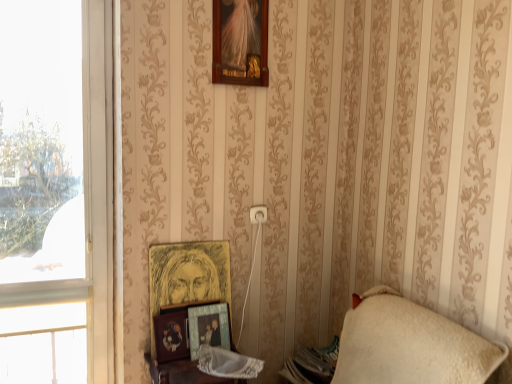
What is the approximate height of white fabric window at left, the 1th window from the bottom?

white fabric window at left, the 1th window from the bottom, is 8.51 inches tall.

In order to click on metallic silver frame at lower center, positioned as the 1th picture frame in bottom-to-top order in this screenshot , I will do `click(208, 327)`.

What do you see at coordinates (189, 273) in the screenshot? I see `gold textured frame at center, arranged as the 2th picture frame when viewed from the top` at bounding box center [189, 273].

This screenshot has width=512, height=384. What do you see at coordinates (170, 336) in the screenshot?
I see `wooden photo frame at lower center, which is the 2th picture frame from bottom to top` at bounding box center [170, 336].

The image size is (512, 384). What do you see at coordinates (183, 373) in the screenshot?
I see `wooden table at lower center` at bounding box center [183, 373].

The width and height of the screenshot is (512, 384). I want to click on white fabric window at left, which is the second window from top to bottom, so click(42, 344).

Is wooden photo frame at lower center, marked as the third picture frame in a top-to-bottom arrangement, not within transparent glass window at left, the first window from the top?

Yes.

From the image's perspective, who appears lower, wooden photo frame at lower center, which is the 2th picture frame from bottom to top, or transparent glass window at left, the first window from the top?

wooden photo frame at lower center, which is the 2th picture frame from bottom to top, is shown below in the image.

From a real-world perspective, which is physically above, wooden photo frame at lower center, which is the 2th picture frame from bottom to top, or transparent glass window at left, the first window from the top?

transparent glass window at left, the first window from the top.

Is the surface of wooden photo frame at lower center, marked as the third picture frame in a top-to-bottom arrangement, in direct contact with transparent glass window at left, the first window from the top?

wooden photo frame at lower center, marked as the third picture frame in a top-to-bottom arrangement, and transparent glass window at left, the first window from the top, are clearly separated.

Who is shorter, wooden photo frame at lower center, which is the 2th picture frame from bottom to top, or wooden table at lower center?

wooden photo frame at lower center, which is the 2th picture frame from bottom to top, is shorter.

Is wooden photo frame at lower center, which is the 2th picture frame from bottom to top, bigger or smaller than wooden table at lower center?

In the image, wooden photo frame at lower center, which is the 2th picture frame from bottom to top, appears to be smaller than wooden table at lower center.

Can we say wooden photo frame at lower center, which is the 2th picture frame from bottom to top, lies outside wooden table at lower center?

That's correct, wooden photo frame at lower center, which is the 2th picture frame from bottom to top, is outside of wooden table at lower center.

From a real-world perspective, who is located higher, wooden photo frame at lower center, marked as the third picture frame in a top-to-bottom arrangement, or wooden table at lower center?

From a 3D spatial view, wooden photo frame at lower center, marked as the third picture frame in a top-to-bottom arrangement, is above.

From a real-world perspective, who is located higher, metallic silver frame at lower center, the 4th picture frame positioned from the top, or wooden frame at upper center, the 4th picture frame when ordered from bottom to top?

wooden frame at upper center, the 4th picture frame when ordered from bottom to top.

Is metallic silver frame at lower center, the 4th picture frame positioned from the top, in front of or behind wooden frame at upper center, the 4th picture frame when ordered from bottom to top, in the image?

In the image, metallic silver frame at lower center, the 4th picture frame positioned from the top, appears behind wooden frame at upper center, the 4th picture frame when ordered from bottom to top.

Which object is thinner, metallic silver frame at lower center, the 4th picture frame positioned from the top, or wooden frame at upper center, the 1th picture frame from the top?

wooden frame at upper center, the 1th picture frame from the top.

Identify the location of the 2nd picture frame in front when counting from the metallic silver frame at lower center, the 4th picture frame positioned from the top. Image resolution: width=512 pixels, height=384 pixels. (240, 42).

Is white fabric window at left, which is the second window from top to bottom, shorter than wooden table at lower center?

Yes.

Identify the location of the 2nd window behind the wooden table at lower center. The height and width of the screenshot is (384, 512). (42, 344).

From a real-world perspective, which object stands above the other?

white fabric window at left, which is the second window from top to bottom, from a real-world perspective.

Does white fabric window at left, the 1th window from the bottom, have a smaller size compared to wooden table at lower center?

Correct, white fabric window at left, the 1th window from the bottom, occupies less space than wooden table at lower center.

Is point (215, 322) less distant than point (173, 312)?

That is False.

Based on their positions, is metallic silver frame at lower center, the 4th picture frame positioned from the top, located to the left or right of wooden photo frame at lower center, which is the 2th picture frame from bottom to top?

Clearly, metallic silver frame at lower center, the 4th picture frame positioned from the top, is on the right of wooden photo frame at lower center, which is the 2th picture frame from bottom to top, in the image.

Which object is thinner, metallic silver frame at lower center, the 4th picture frame positioned from the top, or wooden photo frame at lower center, marked as the third picture frame in a top-to-bottom arrangement?

metallic silver frame at lower center, the 4th picture frame positioned from the top.

Does metallic silver frame at lower center, the 4th picture frame positioned from the top, turn towards wooden photo frame at lower center, which is the 2th picture frame from bottom to top?

No, metallic silver frame at lower center, the 4th picture frame positioned from the top, is not facing towards wooden photo frame at lower center, which is the 2th picture frame from bottom to top.

Is transparent glass window at left, the 2th window in the bottom-to-top sequence, inside or outside of wooden photo frame at lower center, which is the 2th picture frame from bottom to top?

The correct answer is: outside.

Consider the image. From the image's perspective, does transparent glass window at left, the first window from the top, appear higher than wooden photo frame at lower center, which is the 2th picture frame from bottom to top?

Yes, from the image's perspective, transparent glass window at left, the first window from the top, is on top of wooden photo frame at lower center, which is the 2th picture frame from bottom to top.

Considering the relative sizes of transparent glass window at left, the first window from the top, and wooden photo frame at lower center, which is the 2th picture frame from bottom to top, in the image provided, is transparent glass window at left, the first window from the top, thinner than wooden photo frame at lower center, which is the 2th picture frame from bottom to top,?

Yes.

Where is `picture frame that is the 2nd one when counting downward from the transparent glass window at left, the first window from the top (from the image's perspective)`? picture frame that is the 2nd one when counting downward from the transparent glass window at left, the first window from the top (from the image's perspective) is located at coordinates (170, 336).

Is point (170, 360) farther from viewer compared to point (33, 365)?

No, (170, 360) is in front of (33, 365).

From a real-world perspective, starting from the wooden photo frame at lower center, which is the 2th picture frame from bottom to top, which window is the 1st one vertically above it? Please provide its 2D coordinates.

[(42, 344)]

Considering the relative positions of wooden photo frame at lower center, marked as the third picture frame in a top-to-bottom arrangement, and white fabric window at left, the 1th window from the bottom, in the image provided, is wooden photo frame at lower center, marked as the third picture frame in a top-to-bottom arrangement, to the left or to the right of white fabric window at left, the 1th window from the bottom,?

wooden photo frame at lower center, marked as the third picture frame in a top-to-bottom arrangement, is to the right of white fabric window at left, the 1th window from the bottom.

From the picture: Is wooden photo frame at lower center, which is the 2th picture frame from bottom to top, closer to the viewer compared to white fabric window at left, the 1th window from the bottom?

Yes, wooden photo frame at lower center, which is the 2th picture frame from bottom to top, is in front of white fabric window at left, the 1th window from the bottom.

At what (x,y) coordinates should I click in order to perform the action: click on window that is the 2nd one when counting leftward from the wooden photo frame at lower center, marked as the third picture frame in a top-to-bottom arrangement. Please return your answer as a coordinate pair (x, y). The height and width of the screenshot is (384, 512). Looking at the image, I should click on (90, 200).

At what (x,y) coordinates should I click in order to perform the action: click on furniture that appears on the right of wooden photo frame at lower center, marked as the third picture frame in a top-to-bottom arrangement. Please return your answer as a coordinate pair (x, y). Looking at the image, I should click on (183, 373).

Which object lies nearer to the anchor point white fabric window at left, the 1th window from the bottom, wooden photo frame at lower center, marked as the third picture frame in a top-to-bottom arrangement, or wooden frame at upper center, the 4th picture frame when ordered from bottom to top?

wooden photo frame at lower center, marked as the third picture frame in a top-to-bottom arrangement, is closer to white fabric window at left, the 1th window from the bottom.

Based on their spatial positions, is wooden table at lower center or transparent glass window at left, the 2th window in the bottom-to-top sequence, further from gold textured frame at center, arranged as the 2th picture frame when viewed from the top?

transparent glass window at left, the 2th window in the bottom-to-top sequence, is positioned further to the anchor gold textured frame at center, arranged as the 2th picture frame when viewed from the top.

When comparing their distances from wooden frame at upper center, the 1th picture frame from the top, does gold textured frame at center, arranged as the 2th picture frame when viewed from the top, or white fabric window at left, which is the second window from top to bottom, seem closer?

gold textured frame at center, arranged as the 2th picture frame when viewed from the top, is positioned closer to the anchor wooden frame at upper center, the 1th picture frame from the top.

Based on their spatial positions, is transparent glass window at left, the 2th window in the bottom-to-top sequence, or gold textured frame at center, the third picture frame ordered from the bottom, closer to white fabric window at left, the 1th window from the bottom?

transparent glass window at left, the 2th window in the bottom-to-top sequence.

When comparing their distances from gold textured frame at center, arranged as the 2th picture frame when viewed from the top, does wooden frame at upper center, the 1th picture frame from the top, or wooden table at lower center seem closer?

wooden table at lower center is positioned closer to the anchor gold textured frame at center, arranged as the 2th picture frame when viewed from the top.

Estimate the real-world distances between objects in this image. Which object is further from wooden frame at upper center, the 4th picture frame when ordered from bottom to top, transparent glass window at left, the 2th window in the bottom-to-top sequence, or gold textured frame at center, the third picture frame ordered from the bottom?

Based on the image, gold textured frame at center, the third picture frame ordered from the bottom, appears to be further to wooden frame at upper center, the 4th picture frame when ordered from bottom to top.

Estimate the real-world distances between objects in this image. Which object is further from transparent glass window at left, the 2th window in the bottom-to-top sequence, gold textured frame at center, arranged as the 2th picture frame when viewed from the top, or wooden table at lower center?

wooden table at lower center.

When comparing their distances from wooden photo frame at lower center, which is the 2th picture frame from bottom to top, does gold textured frame at center, arranged as the 2th picture frame when viewed from the top, or metallic silver frame at lower center, the 4th picture frame positioned from the top, seem closer?

The object closer to wooden photo frame at lower center, which is the 2th picture frame from bottom to top, is metallic silver frame at lower center, the 4th picture frame positioned from the top.

Identify the location of picture frame located between white fabric window at left, which is the second window from top to bottom, and gold textured frame at center, arranged as the 2th picture frame when viewed from the top, in the left-right direction. This screenshot has width=512, height=384. (170, 336).

Locate an element on the screen. window located between transparent glass window at left, the 2th window in the bottom-to-top sequence, and wooden table at lower center in the left-right direction is located at coordinates (42, 344).

Where is `window between transparent glass window at left, the 2th window in the bottom-to-top sequence, and gold textured frame at center, arranged as the 2th picture frame when viewed from the top`? window between transparent glass window at left, the 2th window in the bottom-to-top sequence, and gold textured frame at center, arranged as the 2th picture frame when viewed from the top is located at coordinates (42, 344).

Find the location of a particular element. window between transparent glass window at left, the first window from the top, and metallic silver frame at lower center, positioned as the 1th picture frame in bottom-to-top order is located at coordinates (42, 344).